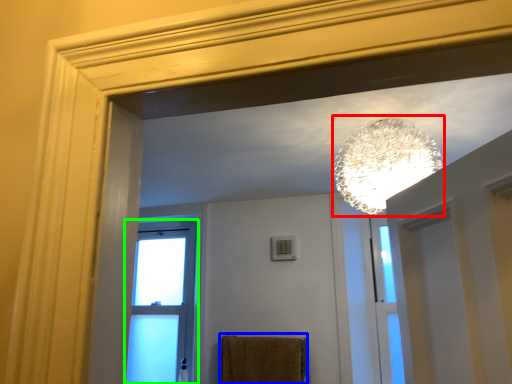
Question: Which object is the farthest from lamp (highlighted by a red box)? Choose among these: bath towel (highlighted by a blue box) or window (highlighted by a green box).

Choices:
 (A) bath towel
 (B) window

Answer: (B)